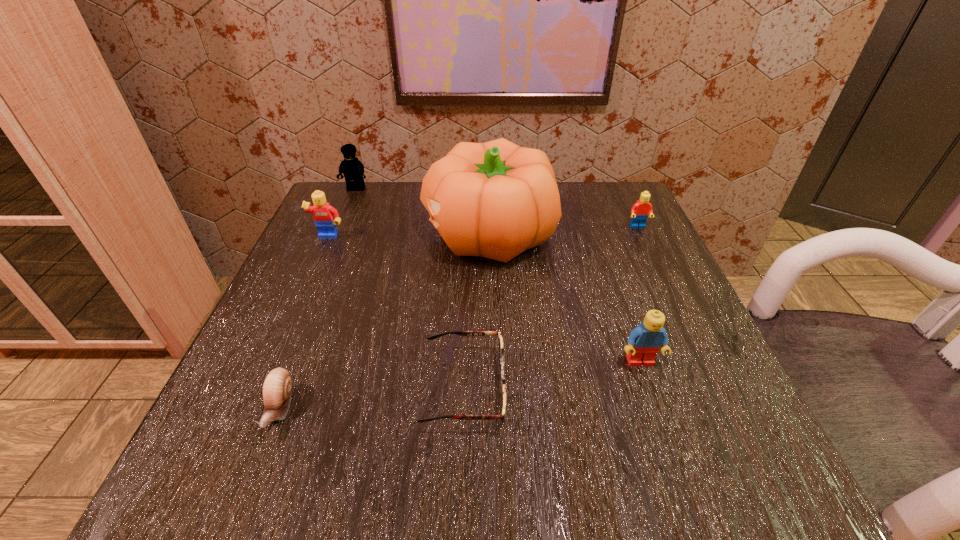
Locate an element on the screen. vacant space situated on the carved face of the tallest object is located at coordinates (391, 234).

Find the location of a particular element. The width and height of the screenshot is (960, 540). free space located on the carved face of the tallest object is located at coordinates (317, 234).

Find the location of a particular element. This screenshot has height=540, width=960. vacant region located 0.050m on the front-facing side of the farthest Lego is located at coordinates (349, 205).

Locate an element on the screen. This screenshot has width=960, height=540. vacant space located on the face of the second nearest Lego is located at coordinates (259, 395).

Identify the location of vacant space situated on the face of the second Lego from right to left. (668, 443).

Identify the location of vacant space located on the face of the rightmost Lego. (711, 384).

Locate an element on the screen. Image resolution: width=960 pixels, height=540 pixels. vacant space located 0.280m on the frame of the shortest object is located at coordinates (693, 388).

Where is `pumpkin that is positioned at the far edge`? pumpkin that is positioned at the far edge is located at coordinates (496, 199).

At what (x,y) coordinates should I click in order to perform the action: click on escargot at the near edge. Please return your answer as a coordinate pair (x, y). This screenshot has height=540, width=960. Looking at the image, I should click on (277, 386).

Locate an element on the screen. This screenshot has height=540, width=960. spectacles that is at the near edge is located at coordinates (462, 333).